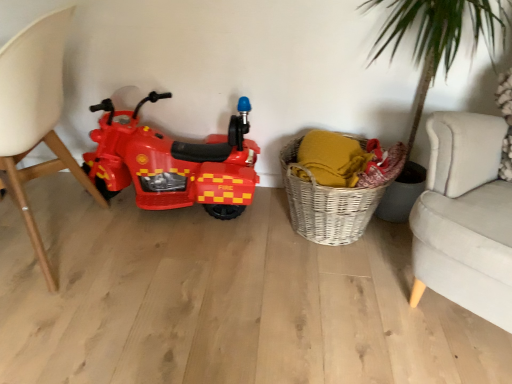
This screenshot has height=384, width=512. I want to click on vacant area that lies between matte white chair at left and shiny plastic toy motorcycle at left, so click(145, 237).